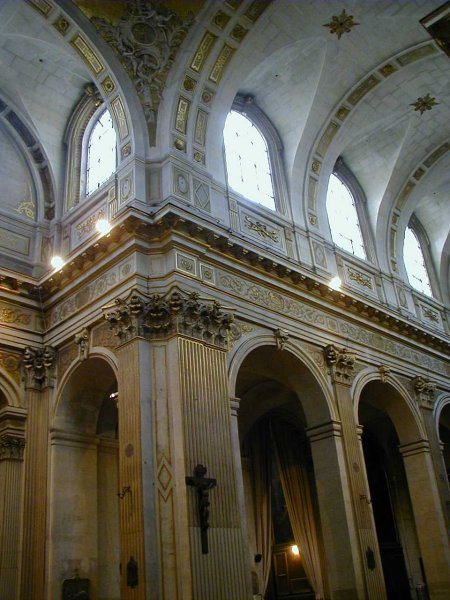
The width and height of the screenshot is (450, 600). I want to click on light, so click(294, 549).